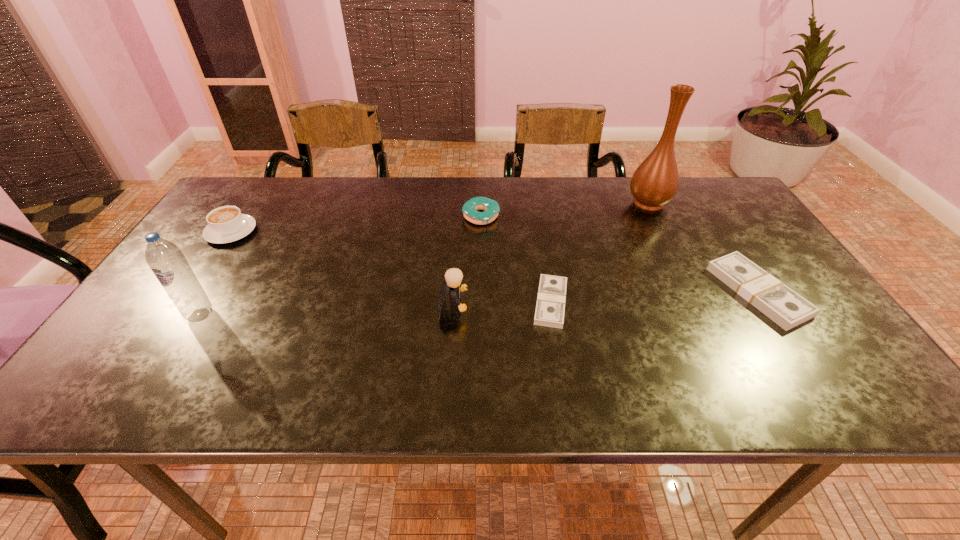
The height and width of the screenshot is (540, 960). I want to click on free area in between the right dollar and the shortest object, so click(654, 297).

Where is `empty space that is in between the Lego and the second tallest object`? empty space that is in between the Lego and the second tallest object is located at coordinates (326, 311).

Identify which object is the third nearest to the third shortest object. Please provide its 2D coordinates. Your answer should be formatted as a tuple, i.e. [(x, y)], where the tuple contains the x and y coordinates of a point satisfying the conditions above.

[(655, 182)]

Locate which object ranks second in proximity to the taller dollar. Please provide its 2D coordinates. Your answer should be formatted as a tuple, i.e. [(x, y)], where the tuple contains the x and y coordinates of a point satisfying the conditions above.

[(550, 307)]

The width and height of the screenshot is (960, 540). Identify the location of free region that satisfies the following two spatial constraints: 1. on the front-facing side of the third tallest object; 2. on the front side of the water bottle. (452, 315).

You are a GUI agent. You are given a task and a screenshot of the screen. Output one action in this format:
    pyautogui.click(x=<x>, y=<y>)
    Task: Click on the vacant region that satisfies the following two spatial constraints: 1. on the front side of the tallest object; 2. on the right side of the right dollar
    
    Given the screenshot: What is the action you would take?
    pyautogui.click(x=693, y=292)

Image resolution: width=960 pixels, height=540 pixels. I want to click on free space that satisfies the following two spatial constraints: 1. on the back side of the water bottle; 2. on the right side of the doughnut, so click(261, 217).

You are a GUI agent. You are given a task and a screenshot of the screen. Output one action in this format:
    pyautogui.click(x=<x>, y=<y>)
    Task: Click on the free space that satisfies the following two spatial constraints: 1. on the front side of the vase; 2. on the front-facing side of the Lego
    The width and height of the screenshot is (960, 540).
    Given the screenshot: What is the action you would take?
    pyautogui.click(x=701, y=307)